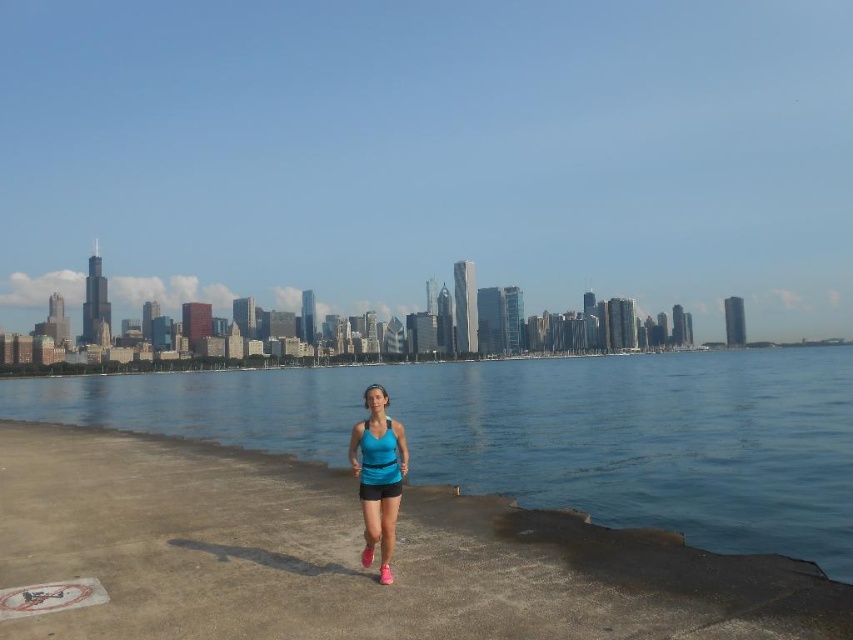
Question: Which object is closer to the camera taking this photo?

Choices:
 (A) blue water at center
 (B) blue fabric tank top at center

Answer: (B)

Question: Can you confirm if blue water at center is bigger than blue fabric tank top at center?

Choices:
 (A) yes
 (B) no

Answer: (A)

Question: Can you confirm if blue water at center is positioned above blue fabric tank top at center?

Choices:
 (A) yes
 (B) no

Answer: (B)

Question: Which of the following is the farthest from the observer?

Choices:
 (A) blue water at center
 (B) blue fabric tank top at center

Answer: (A)

Question: Is blue water at center smaller than blue fabric tank top at center?

Choices:
 (A) no
 (B) yes

Answer: (A)